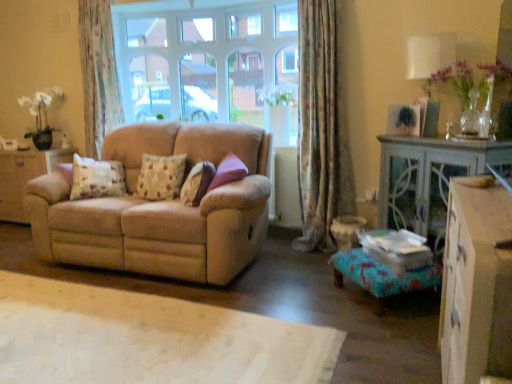
Question: Are white fabric lampshade at upper right and fluffy floral pillow at center, the 2th pillow from the right, far apart?

Choices:
 (A) no
 (B) yes

Answer: (B)

Question: Considering the relative positions of white fabric lampshade at upper right and fluffy floral pillow at center, the 2th pillow from the right, in the image provided, is white fabric lampshade at upper right to the left of fluffy floral pillow at center, the 2th pillow from the right, from the viewer's perspective?

Choices:
 (A) no
 (B) yes

Answer: (A)

Question: Does white fabric lampshade at upper right have a smaller size compared to fluffy floral pillow at center, the 2th pillow from the right?

Choices:
 (A) yes
 (B) no

Answer: (B)

Question: From the image's perspective, is white fabric lampshade at upper right beneath fluffy floral pillow at center, which is counted as the second pillow, starting from the left?

Choices:
 (A) yes
 (B) no

Answer: (B)

Question: Is white fabric lampshade at upper right at the right side of fluffy floral pillow at center, the 2th pillow from the right?

Choices:
 (A) no
 (B) yes

Answer: (B)

Question: Is clear glass window at center bigger or smaller than floral fabric curtain at upper left, which is counted as the 2th curtain, starting from the front?

Choices:
 (A) big
 (B) small

Answer: (A)

Question: In the image, is clear glass window at center positioned in front of or behind floral fabric curtain at upper left, marked as the 1th curtain in a left-to-right arrangement?

Choices:
 (A) front
 (B) behind

Answer: (A)

Question: Is clear glass window at center inside or outside of floral fabric curtain at upper left, marked as the 1th curtain in a left-to-right arrangement?

Choices:
 (A) inside
 (B) outside

Answer: (B)

Question: From a real-world perspective, is clear glass window at center positioned above or below floral fabric curtain at upper left, the 1th curtain viewed from the back?

Choices:
 (A) below
 (B) above

Answer: (B)

Question: Looking at the image, does fluffy beige pillow at center, the first pillow in the right-to-left sequence, seem bigger or smaller compared to wooden cabinet at lower right, acting as the 1th dresser starting from the front?

Choices:
 (A) small
 (B) big

Answer: (A)

Question: Relative to wooden cabinet at lower right, which is the 2th dresser from left to right, is fluffy beige pillow at center, the first pillow in the right-to-left sequence, in front or behind?

Choices:
 (A) behind
 (B) front

Answer: (A)

Question: Considering the relative positions of fluffy beige pillow at center, the first pillow in the right-to-left sequence, and wooden cabinet at lower right, arranged as the first dresser when viewed from the right, in the image provided, is fluffy beige pillow at center, the first pillow in the right-to-left sequence, to the left or to the right of wooden cabinet at lower right, arranged as the first dresser when viewed from the right,?

Choices:
 (A) right
 (B) left

Answer: (B)

Question: Which is correct: fluffy beige pillow at center, which is the 3th pillow in left-to-right order, is inside wooden cabinet at lower right, acting as the 1th dresser starting from the front, or outside of it?

Choices:
 (A) outside
 (B) inside

Answer: (A)

Question: Considering the positions of turquoise fabric footrest at lower right and beige corduroy couch at center in the image, is turquoise fabric footrest at lower right taller or shorter than beige corduroy couch at center?

Choices:
 (A) tall
 (B) short

Answer: (B)

Question: Looking at their shapes, would you say turquoise fabric footrest at lower right is wider or thinner than beige corduroy couch at center?

Choices:
 (A) wide
 (B) thin

Answer: (B)